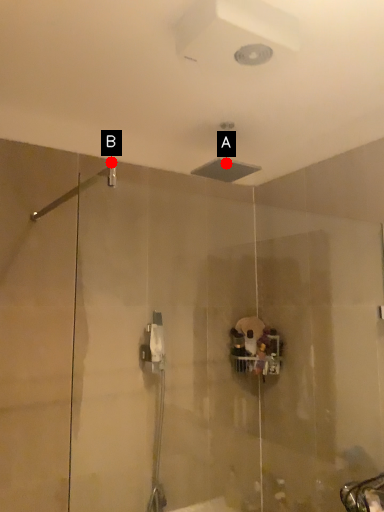
Question: Two points are circled on the image, labeled by A and B beside each circle. Which point is farther to the camera?

Choices:
 (A) A is further
 (B) B is further

Answer: (B)